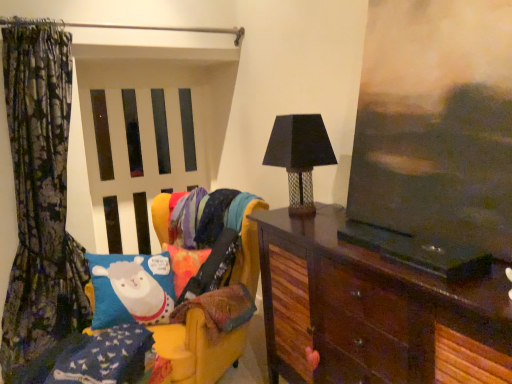
Question: Is floral fabric curtain at left thinner than velvet yellow swivel chair at left?

Choices:
 (A) yes
 (B) no

Answer: (A)

Question: From a real-world perspective, is floral fabric curtain at left on velvet yellow swivel chair at left?

Choices:
 (A) yes
 (B) no

Answer: (A)

Question: Is floral fabric curtain at left not within velvet yellow swivel chair at left?

Choices:
 (A) no
 (B) yes

Answer: (B)

Question: Is the position of floral fabric curtain at left more distant than that of velvet yellow swivel chair at left?

Choices:
 (A) yes
 (B) no

Answer: (A)

Question: Is floral fabric curtain at left oriented towards velvet yellow swivel chair at left?

Choices:
 (A) yes
 (B) no

Answer: (B)

Question: Is floral fabric curtain at left positioned in front of velvet yellow swivel chair at left?

Choices:
 (A) no
 (B) yes

Answer: (A)

Question: Is dark wood cabinet at right taller than white matte screen door at center?

Choices:
 (A) yes
 (B) no

Answer: (B)

Question: Is white matte screen door at center completely or partially inside dark wood cabinet at right?

Choices:
 (A) no
 (B) yes

Answer: (A)

Question: Is dark wood cabinet at right positioned far away from white matte screen door at center?

Choices:
 (A) yes
 (B) no

Answer: (A)

Question: From a real-world perspective, is dark wood cabinet at right on white matte screen door at center?

Choices:
 (A) yes
 (B) no

Answer: (B)

Question: Can we say dark wood cabinet at right lies outside white matte screen door at center?

Choices:
 (A) yes
 (B) no

Answer: (A)

Question: Can you confirm if dark wood cabinet at right is positioned to the left of white matte screen door at center?

Choices:
 (A) yes
 (B) no

Answer: (B)

Question: Is dark wood cabinet at right far from floral fabric curtain at left?

Choices:
 (A) yes
 (B) no

Answer: (A)